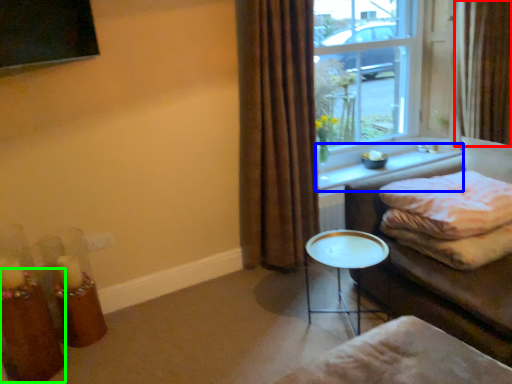
Question: Which is farther away from curtain (highlighted by a red box)? window sill (highlighted by a blue box) or candle holder (highlighted by a green box)?

Choices:
 (A) window sill
 (B) candle holder

Answer: (B)